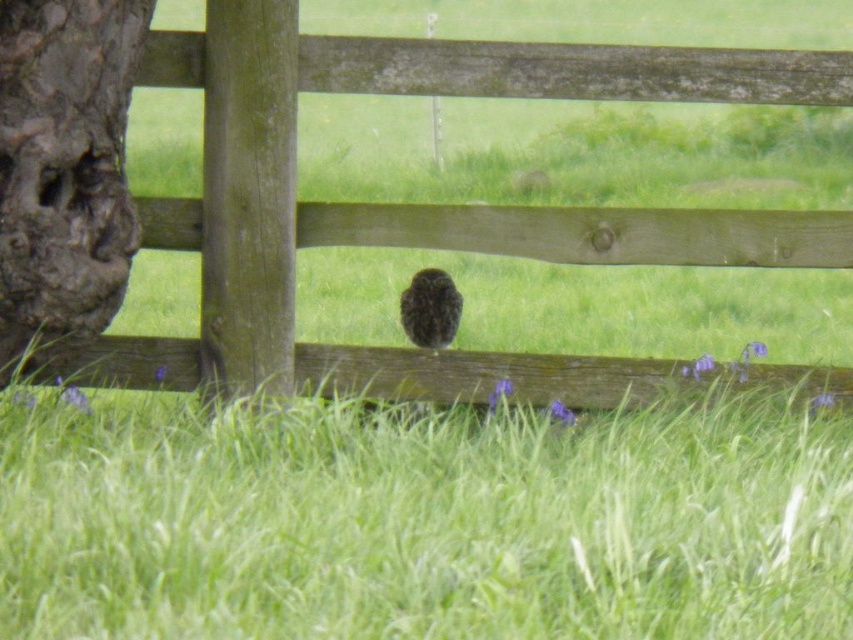
Does wooden fence at center appear under rough bark tree trunk at left?

Correct, wooden fence at center is located below rough bark tree trunk at left.

Who is positioned more to the left, wooden fence at center or rough bark tree trunk at left?

Positioned to the left is rough bark tree trunk at left.

Does point (503, 60) lie behind point (62, 3)?

Yes, point (503, 60) is farther from viewer.

Where is `wooden fence at center`? This screenshot has width=853, height=640. wooden fence at center is located at coordinates (433, 211).

Where is `rough bark tree trunk at left`? This screenshot has height=640, width=853. rough bark tree trunk at left is located at coordinates (64, 168).

The height and width of the screenshot is (640, 853). What do you see at coordinates (64, 168) in the screenshot?
I see `rough bark tree trunk at left` at bounding box center [64, 168].

Where is `rough bark tree trunk at left`? rough bark tree trunk at left is located at coordinates (64, 168).

Does wooden fence at center appear under dark brown owl at center?

No, wooden fence at center is not below dark brown owl at center.

Does wooden fence at center lie in front of dark brown owl at center?

Yes, it is.

Does point (570, 260) lie behind point (404, 317)?

No, it is in front of (404, 317).

Find the location of a particular element. wooden fence at center is located at coordinates (433, 211).